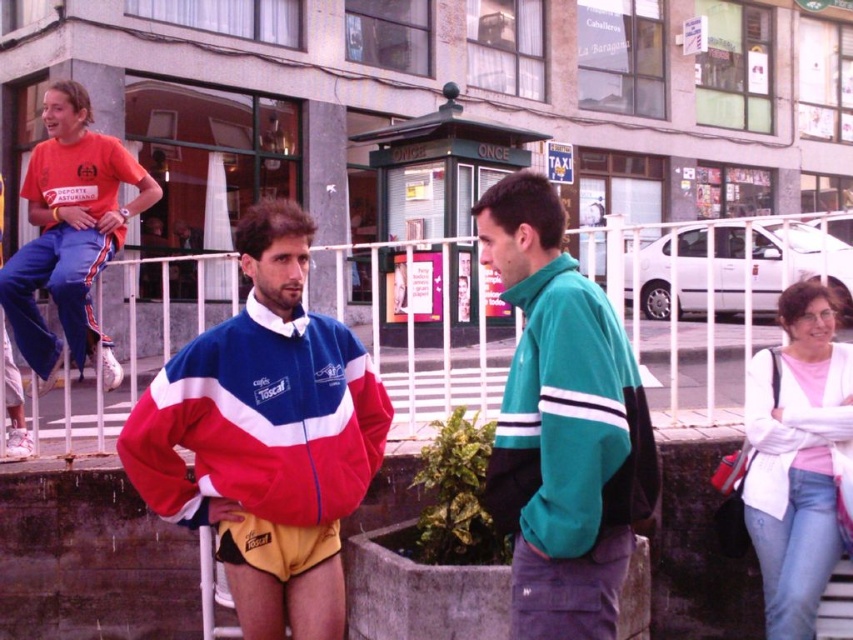
Between red and white fleece jacket at center and teal fleece jacket at center, which one is positioned lower?

Positioned lower is red and white fleece jacket at center.

Is red and white fleece jacket at center closer to camera compared to teal fleece jacket at center?

No.

This screenshot has height=640, width=853. Describe the element at coordinates (265, 436) in the screenshot. I see `red and white fleece jacket at center` at that location.

You are a GUI agent. You are given a task and a screenshot of the screen. Output one action in this format:
    pyautogui.click(x=<x>, y=<y>)
    Task: Click on the red and white fleece jacket at center
    This screenshot has height=640, width=853.
    Given the screenshot: What is the action you would take?
    pyautogui.click(x=265, y=436)

Is teal fleece jacket at center bigger than matte orange t-shirt at upper left?

No.

Who is shorter, teal fleece jacket at center or matte orange t-shirt at upper left?

Standing shorter between the two is teal fleece jacket at center.

Where is `teal fleece jacket at center`? teal fleece jacket at center is located at coordinates (561, 426).

Locate an element on the screen. teal fleece jacket at center is located at coordinates (561, 426).

Between point (254, 388) and point (670, 419), which one is positioned in front?

Point (254, 388) is more forward.

Between point (270, 371) and point (431, 294), which one is positioned in front?

Point (270, 371)

I want to click on red and white fleece jacket at center, so click(265, 436).